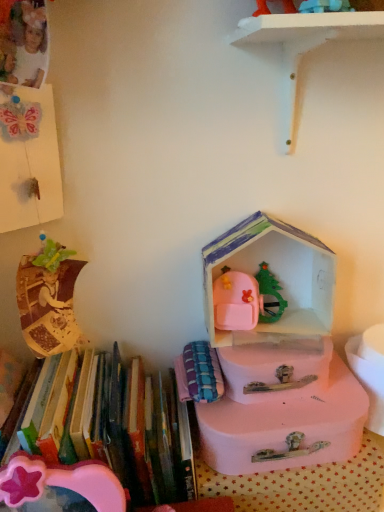
Question: Looking at their shapes, would you say pink plastic box at center is wider or thinner than pink cardboard house at center, positioned as the second storage box in bottom-to-top order?

Choices:
 (A) wide
 (B) thin

Answer: (A)

Question: From the image's perspective, relative to pink cardboard house at center, acting as the 1th storage box starting from the top, is pink plastic box at center above or below?

Choices:
 (A) above
 (B) below

Answer: (B)

Question: Which is farther from the pink plastic box at center?

Choices:
 (A) plaid fabric book at center, the first book viewed from the right
 (B) white matte shelf at upper center
 (C) pink plastic suitcase at center, the 1th storage box positioned from the bottom
 (D) pink cardboard house at center, positioned as the second storage box in bottom-to-top order
 (E) hardcover books at left, placed as the 2th book when sorted from right to left

Answer: (B)

Question: Based on their relative distances, which object is nearer to the white matte shelf at upper center?

Choices:
 (A) hardcover books at left, placed as the 2th book when sorted from right to left
 (B) pink cardboard house at center, acting as the 1th storage box starting from the top
 (C) pink plastic box at center
 (D) plaid fabric book at center, the first book viewed from the right
 (E) pink plastic suitcase at center, which ranks as the second storage box in top-to-bottom order

Answer: (B)